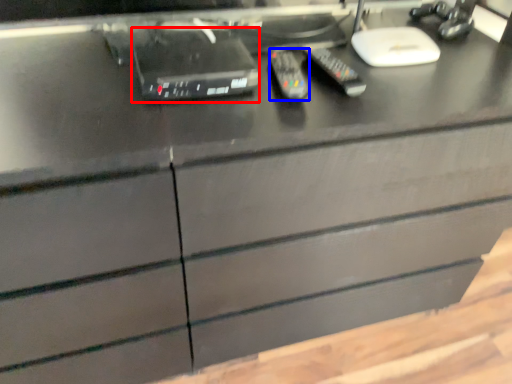
Question: Which of the following is the closest to the observer, equipment (highlighted by a red box) or control (highlighted by a blue box)?

Choices:
 (A) equipment
 (B) control

Answer: (A)